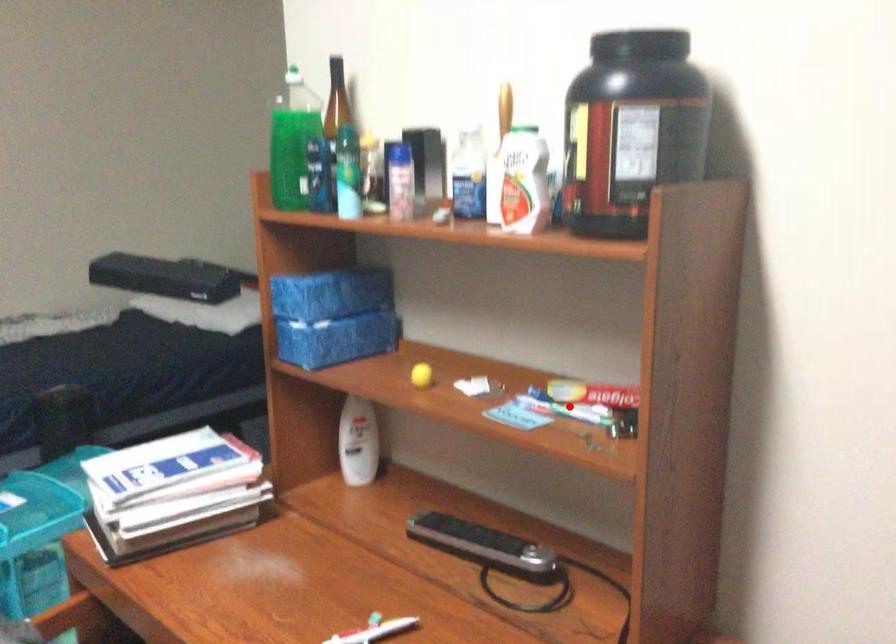
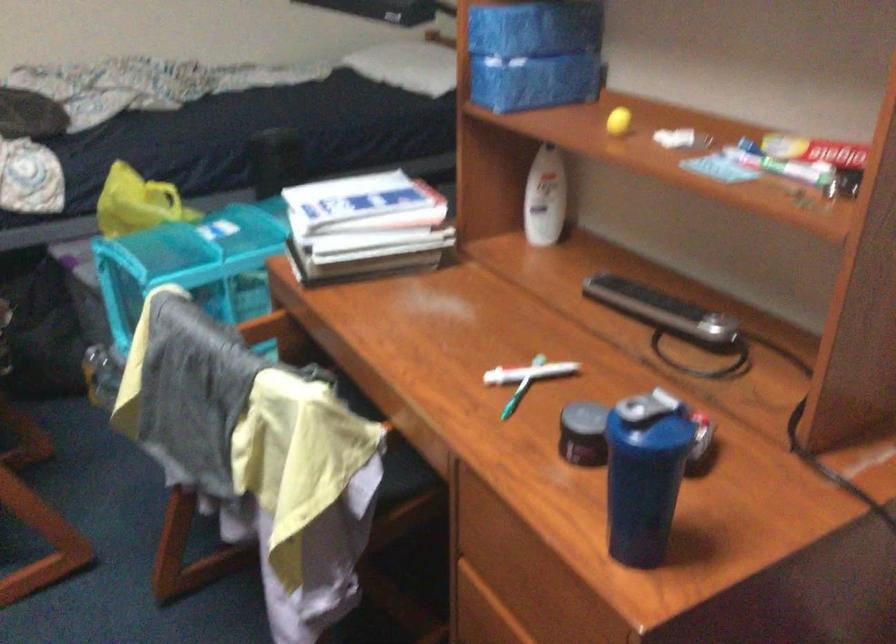
Question: I am providing you with two images of the same scene from different viewpoints. A red point is shown in image1. For the corresponding object point in image2, is it positioned nearer or farther from the camera?

Choices:
 (A) Nearer
 (B) Farther

Answer: (A)